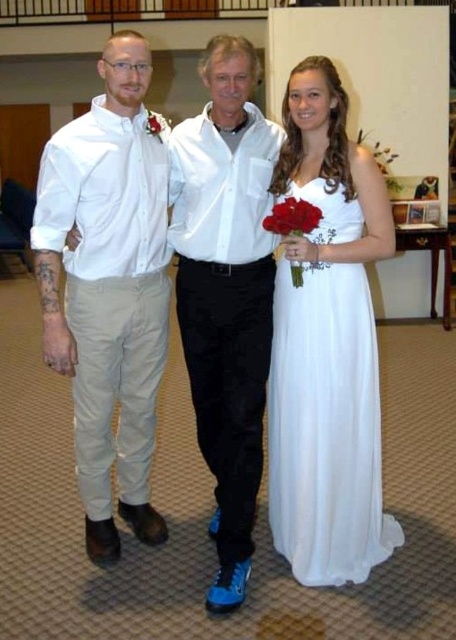
Question: Which object is closer to the camera taking this photo?

Choices:
 (A) white smooth shirt at center
 (B) matte white boutonniere at upper center
 (C) matte red rose at upper center

Answer: (A)

Question: Does white smooth shirt at center appear on the left side of matte white boutonniere at upper center?

Choices:
 (A) yes
 (B) no

Answer: (B)

Question: Which object is closer to the camera taking this photo?

Choices:
 (A) matte khaki pants at left
 (B) matte white shirt at center

Answer: (B)

Question: Can you confirm if matte khaki pants at left is positioned below bright red silk bouquet at center?

Choices:
 (A) yes
 (B) no

Answer: (A)

Question: Is the position of matte white shirt at center less distant than that of bright red silk bouquet at center?

Choices:
 (A) yes
 (B) no

Answer: (B)

Question: Which of the following is the closest to the observer?

Choices:
 (A) white satin dress at right
 (B) matte white shirt at center

Answer: (A)